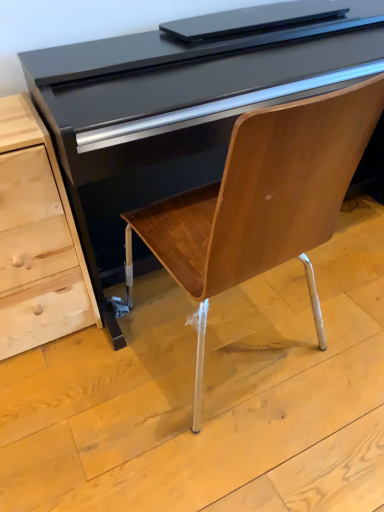
Identify the location of free space to the left of glossy black piano at center. (84, 393).